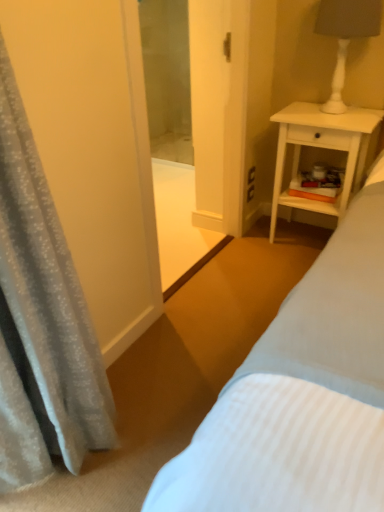
Question: Would you say white matte lamp at upper right is inside or outside white wood nightstand at right?

Choices:
 (A) outside
 (B) inside

Answer: (A)

Question: Looking at their shapes, would you say white matte lamp at upper right is wider or thinner than white wood nightstand at right?

Choices:
 (A) wide
 (B) thin

Answer: (B)

Question: Which object is positioned closest to the silky gray curtain at left?

Choices:
 (A) white matte lamp at upper right
 (B) white wood nightstand at right
 (C) transparent glass screen door at center

Answer: (C)

Question: Based on their relative distances, which object is nearer to the white wood nightstand at right?

Choices:
 (A) transparent glass screen door at center
 (B) silky gray curtain at left
 (C) white matte lamp at upper right

Answer: (A)